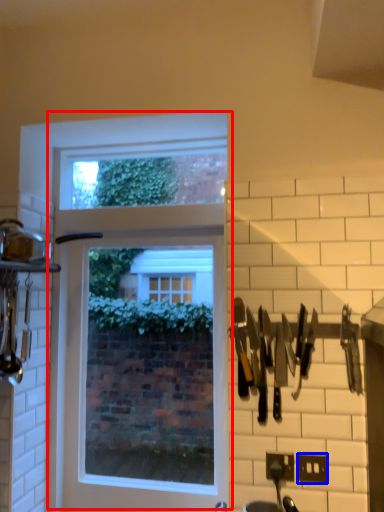
Question: Among these objects, which one is nearest to the camera, window (highlighted by a red box) or electric outlet (highlighted by a blue box)?

Choices:
 (A) window
 (B) electric outlet

Answer: (B)